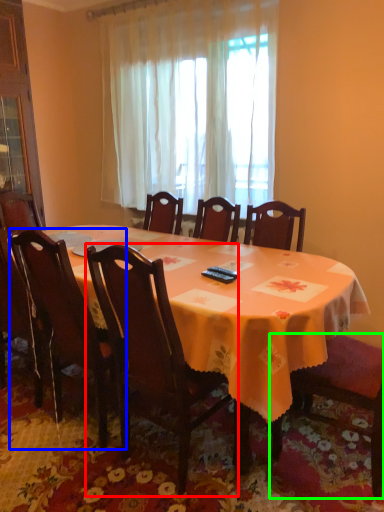
Question: Which object is positioned closest to chair (highlighted by a red box)? Select from chair (highlighted by a blue box) and chair (highlighted by a green box).

Choices:
 (A) chair
 (B) chair

Answer: (A)